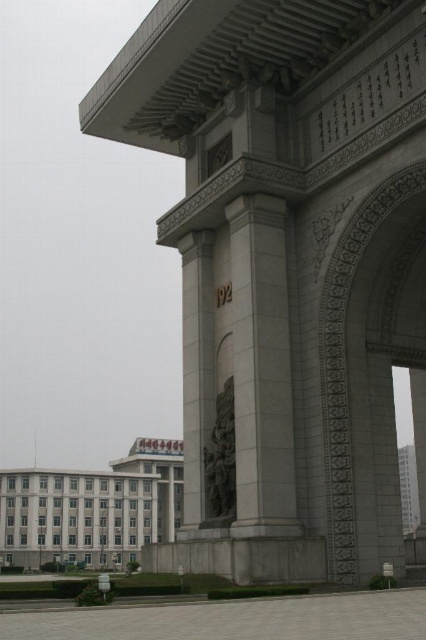
Question: Can you confirm if white stone column at center is positioned to the right of dark gray stone statue at center?

Choices:
 (A) yes
 (B) no

Answer: (A)

Question: Does white concrete building at lower left appear on the left side of dark gray stone statue at center?

Choices:
 (A) yes
 (B) no

Answer: (A)

Question: Among these points, which one is nearest to the camera?

Choices:
 (A) (42, 528)
 (B) (265, 333)

Answer: (B)

Question: Does white stone column at center have a greater width compared to white concrete building at lower left?

Choices:
 (A) no
 (B) yes

Answer: (A)

Question: Which object is positioned closest to the dark gray stone statue at center?

Choices:
 (A) white stone column at center
 (B) white concrete building at lower left

Answer: (A)

Question: Which object is closer to the camera taking this photo?

Choices:
 (A) dark gray stone statue at center
 (B) white stone column at center
 (C) white concrete building at lower left

Answer: (B)